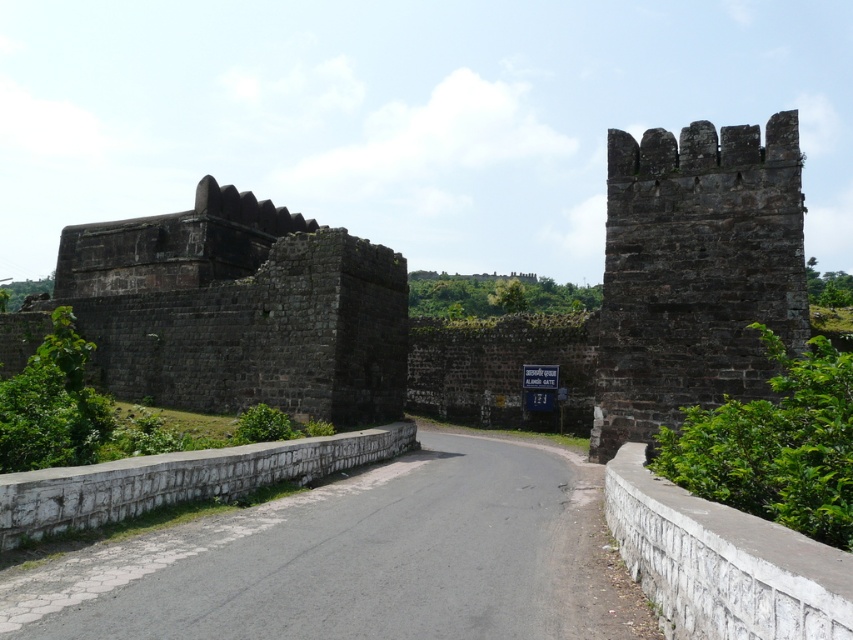
You are standing at the entrance of the historical stone fortification and want to reach the two points marked in the image. Which point, point (306, 236) or point (233, 451), is closer to you?

Point (306, 236) is closer to you because it is further to the viewer than point (233, 451).